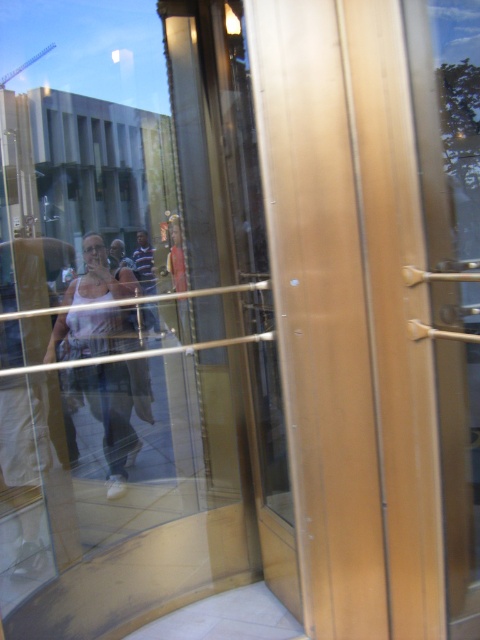
Question: Can you confirm if striped shirt at center is positioned to the left of light brown leather jacket at center?

Choices:
 (A) no
 (B) yes

Answer: (A)

Question: Which point appears farthest from the camera in this image?

Choices:
 (A) (149, 323)
 (B) (116, 333)

Answer: (A)

Question: Observing the image, what is the correct spatial positioning of white matte tank top at center in reference to striped shirt at center?

Choices:
 (A) below
 (B) above

Answer: (A)

Question: Does white matte tank top at center appear under light brown leather jacket at center?

Choices:
 (A) no
 (B) yes

Answer: (B)

Question: Which of the following is the farthest from the observer?

Choices:
 (A) (113, 266)
 (B) (101, 397)

Answer: (A)

Question: Which of the following is the closest to the observer?

Choices:
 (A) white matte tank top at center
 (B) striped shirt at center
 (C) light brown leather jacket at center

Answer: (A)